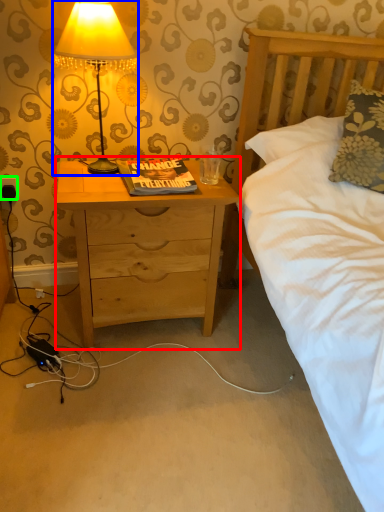
Question: Which object is the closest to the nightstand (highlighted by a red box)? Choose among these: lamp (highlighted by a blue box) or electric outlet (highlighted by a green box).

Choices:
 (A) lamp
 (B) electric outlet

Answer: (A)